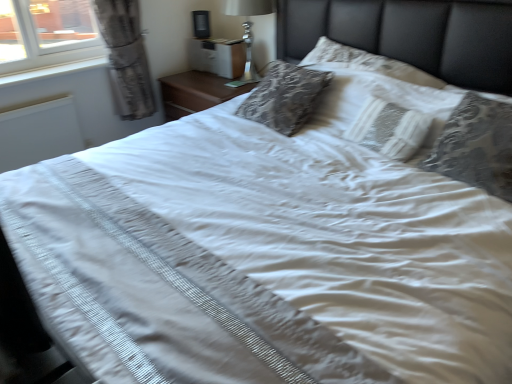
Question: Would you say white plastic window sill at left is to the left or to the right of silver metallic lamp at upper center in the picture?

Choices:
 (A) right
 (B) left

Answer: (B)

Question: From the image's perspective, is white plastic window sill at left located above or below silver metallic lamp at upper center?

Choices:
 (A) above
 (B) below

Answer: (B)

Question: Considering the real-world distances, which object is farthest from the white matte radiator at left?

Choices:
 (A) white plastic window sill at left
 (B) white lace pillow at center, the 2th pillow viewed from the right
 (C) silver metallic lamp at upper center
 (D) patterned fabric pillow at upper right, which is counted as the first pillow, starting from the right

Answer: (D)

Question: Which object is the closest to the patterned fabric pillow at upper right, which is counted as the first pillow, starting from the right?

Choices:
 (A) white lace pillow at center, the 2th pillow viewed from the right
 (B) white matte radiator at left
 (C) white plastic window sill at left
 (D) silver metallic lamp at upper center

Answer: (A)